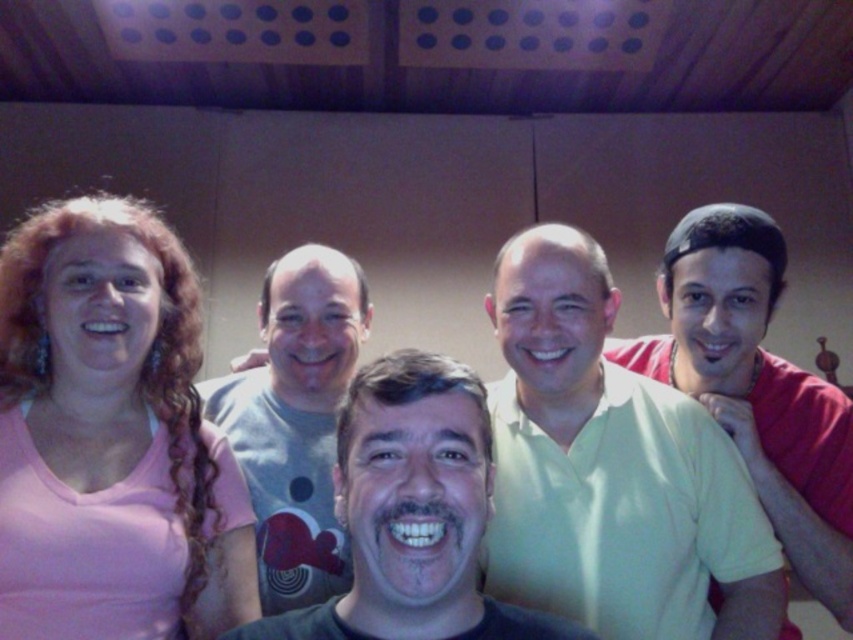
Which is below, black matte shirt at center or gray cotton t-shirt at center?

Positioned lower is black matte shirt at center.

Does black matte shirt at center have a greater height compared to gray cotton t-shirt at center?

In fact, black matte shirt at center may be shorter than gray cotton t-shirt at center.

The height and width of the screenshot is (640, 853). What do you see at coordinates (413, 513) in the screenshot? I see `black matte shirt at center` at bounding box center [413, 513].

The width and height of the screenshot is (853, 640). Identify the location of black matte shirt at center. (413, 513).

Does pink matte shirt at left have a lesser height compared to black matte shirt at center?

In fact, pink matte shirt at left may be taller than black matte shirt at center.

Based on the photo, which is above, pink matte shirt at left or black matte shirt at center?

pink matte shirt at left is higher up.

This screenshot has height=640, width=853. I want to click on pink matte shirt at left, so click(123, 380).

Image resolution: width=853 pixels, height=640 pixels. What are the coordinates of `pink matte shirt at left` in the screenshot? It's located at (123, 380).

Is light yellow t-shirt at right thinner than gray cotton t-shirt at center?

No, light yellow t-shirt at right is not thinner than gray cotton t-shirt at center.

In order to click on light yellow t-shirt at right in this screenshot , I will do `click(756, 387)`.